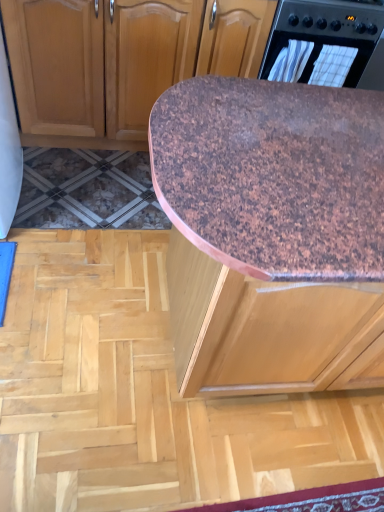
Question: Relative to brown speckled plywood at center, is black plastic oven at upper right in front or behind?

Choices:
 (A) behind
 (B) front

Answer: (A)

Question: From the image's perspective, is black plastic oven at upper right positioned above or below brown speckled plywood at center?

Choices:
 (A) below
 (B) above

Answer: (B)

Question: Which object is the farthest from the brown speckled plywood at center?

Choices:
 (A) black plastic oven at upper right
 (B) brown speckled granite countertop at center

Answer: (A)

Question: Which of these objects is positioned closest to the brown speckled granite countertop at center?

Choices:
 (A) black plastic oven at upper right
 (B) brown speckled plywood at center

Answer: (B)